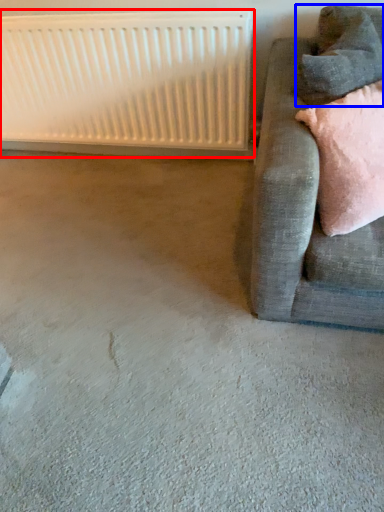
Question: Among these objects, which one is nearest to the camera, radiator (highlighted by a red box) or pillow (highlighted by a blue box)?

Choices:
 (A) radiator
 (B) pillow

Answer: (B)